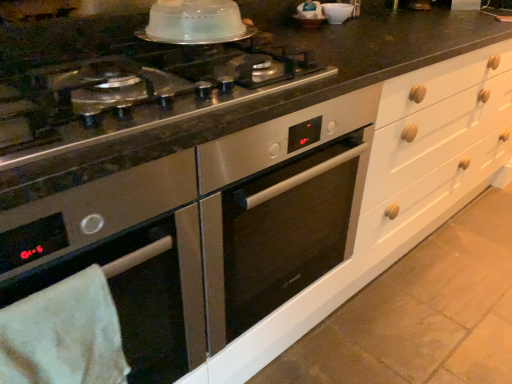
Question: From the image's perspective, relative to white glossy bowl at upper center, is stainless steel cooktop at center above or below?

Choices:
 (A) below
 (B) above

Answer: (A)

Question: Based on their sizes in the image, would you say stainless steel cooktop at center is bigger or smaller than white glossy bowl at upper center?

Choices:
 (A) big
 (B) small

Answer: (A)

Question: Considering the real-world distances, which object is closest to the stainless steel cooktop at center?

Choices:
 (A) clear plastic dome at upper center
 (B) white towel at lower left
 (C) white glossy bowl at upper center

Answer: (A)

Question: Which object is positioned farthest from the white towel at lower left?

Choices:
 (A) white glossy bowl at upper center
 (B) clear plastic dome at upper center
 (C) stainless steel cooktop at center

Answer: (A)